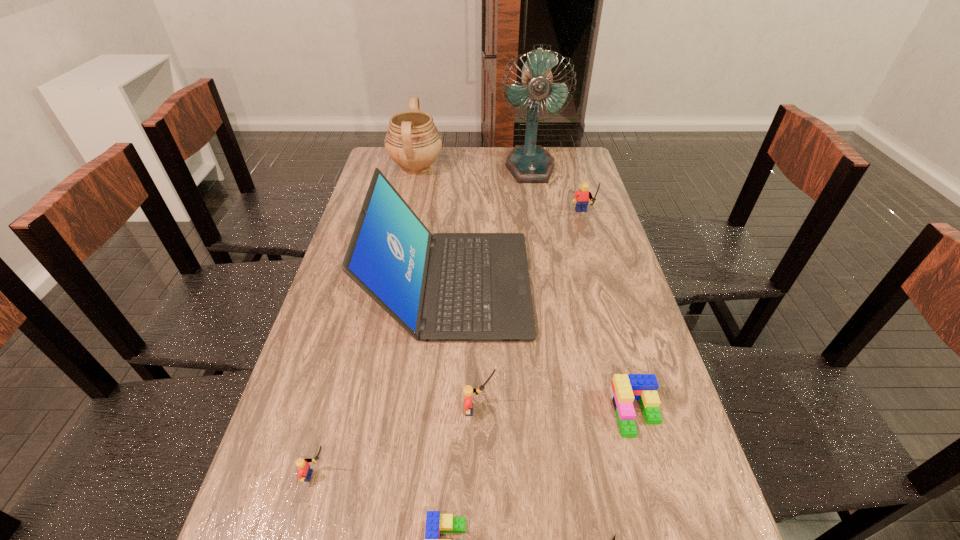
You are a GUI agent. You are given a task and a screenshot of the screen. Output one action in this format:
    pyautogui.click(x=<x>, y=<y>)
    Task: Click on the fan that is at the far edge
    This screenshot has width=960, height=540.
    Given the screenshot: What is the action you would take?
    pyautogui.click(x=530, y=163)

Locate an element on the screen. The height and width of the screenshot is (540, 960). urn that is at the far edge is located at coordinates (413, 142).

Where is `laptop computer positioned at the left edge`? laptop computer positioned at the left edge is located at coordinates (447, 287).

This screenshot has height=540, width=960. Find the location of `urn that is at the left edge`. urn that is at the left edge is located at coordinates (413, 142).

This screenshot has width=960, height=540. What are the coordinates of `Lego positioned at the left edge` in the screenshot? It's located at (304, 473).

The height and width of the screenshot is (540, 960). In order to click on fan that is at the right edge in this screenshot , I will do `click(530, 163)`.

Identify the location of object situated at the far left corner. The image size is (960, 540). (413, 142).

This screenshot has width=960, height=540. I want to click on object that is at the far right corner, so click(x=530, y=163).

You are a GUI agent. You are given a task and a screenshot of the screen. Output one action in this format:
    pyautogui.click(x=<x>, y=<y>)
    Task: Click on the blank space at the far edge of the desktop
    The width and height of the screenshot is (960, 540).
    Given the screenshot: What is the action you would take?
    pyautogui.click(x=499, y=148)

Find the location of `free space at the left edge of the desktop`. free space at the left edge of the desktop is located at coordinates (353, 377).